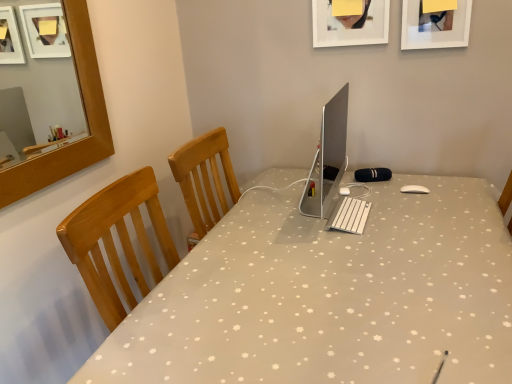
Image resolution: width=512 pixels, height=384 pixels. Identify the location of empty space that is ontop of white plastic keyboard at center. coord(343,210).